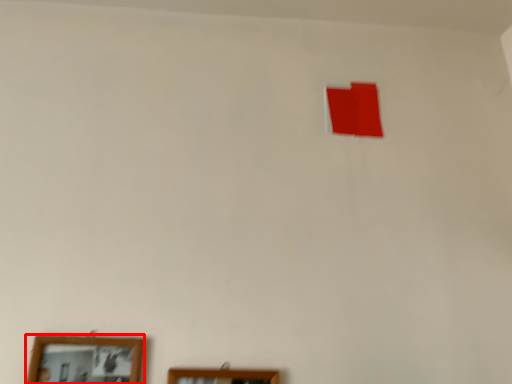
Question: From the image's perspective, considering the relative positions of picture frame (annotated by the red box) and picture frame in the image provided, where is picture frame (annotated by the red box) located with respect to the staircase?

Choices:
 (A) below
 (B) above

Answer: (B)